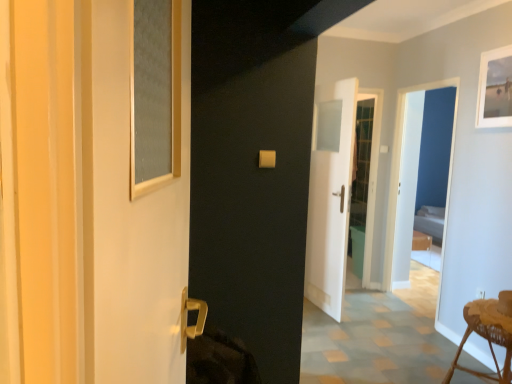
Question: Considering the relative positions of woven wood stool at lower right and white fabric bed at right in the image provided, is woven wood stool at lower right in front of white fabric bed at right?

Choices:
 (A) yes
 (B) no

Answer: (A)

Question: Is white fabric bed at right at the back of woven wood stool at lower right?

Choices:
 (A) yes
 (B) no

Answer: (B)

Question: Could you tell me if woven wood stool at lower right is turned towards white fabric bed at right?

Choices:
 (A) no
 (B) yes

Answer: (A)

Question: Considering the relative sizes of woven wood stool at lower right and white fabric bed at right in the image provided, is woven wood stool at lower right taller than white fabric bed at right?

Choices:
 (A) no
 (B) yes

Answer: (A)

Question: From a real-world perspective, is woven wood stool at lower right physically above white fabric bed at right?

Choices:
 (A) yes
 (B) no

Answer: (A)

Question: Looking at the image, does woven wood stool at lower right seem bigger or smaller compared to matte glass screen door at left, the 1th screen door in the left-to-right sequence?

Choices:
 (A) big
 (B) small

Answer: (A)

Question: From the image's perspective, is woven wood stool at lower right positioned above or below matte glass screen door at left, the 1th screen door in the left-to-right sequence?

Choices:
 (A) above
 (B) below

Answer: (B)

Question: Is woven wood stool at lower right situated inside matte glass screen door at left, the 1th screen door in the left-to-right sequence, or outside?

Choices:
 (A) outside
 (B) inside

Answer: (A)

Question: In terms of height, does woven wood stool at lower right look taller or shorter compared to matte glass screen door at left, the 1th screen door in the left-to-right sequence?

Choices:
 (A) short
 (B) tall

Answer: (A)

Question: Based on their positions, is matte glass screen door at left, which ranks as the 2th screen door in right-to-left order, located to the left or right of white matte picture frame at upper right?

Choices:
 (A) right
 (B) left

Answer: (B)

Question: Is matte glass screen door at left, which ranks as the 2th screen door in right-to-left order, bigger or smaller than white matte picture frame at upper right?

Choices:
 (A) small
 (B) big

Answer: (B)

Question: Is point (181, 74) positioned closer to the camera than point (484, 54)?

Choices:
 (A) closer
 (B) farther

Answer: (A)

Question: In terms of width, does matte glass screen door at left, which ranks as the 2th screen door in right-to-left order, look wider or thinner when compared to white matte picture frame at upper right?

Choices:
 (A) thin
 (B) wide

Answer: (B)

Question: Do you think white matte picture frame at upper right is within white fabric bed at right, or outside of it?

Choices:
 (A) inside
 (B) outside

Answer: (B)

Question: Based on their sizes in the image, would you say white matte picture frame at upper right is bigger or smaller than white fabric bed at right?

Choices:
 (A) small
 (B) big

Answer: (A)